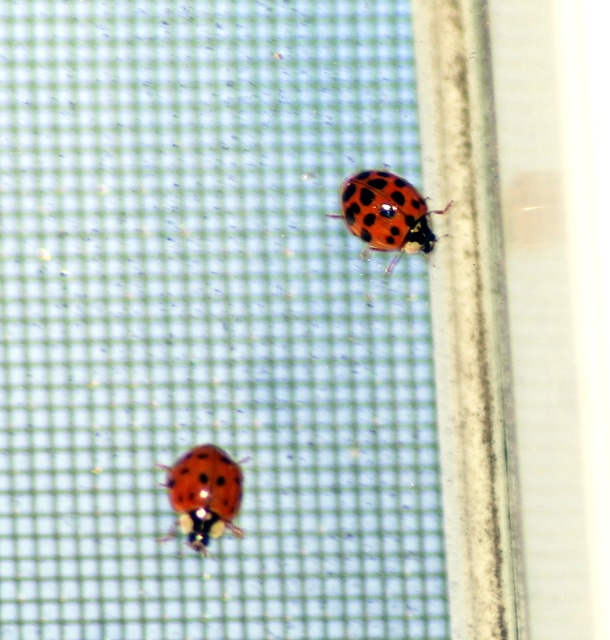
Question: Which object appears closest to the camera in this image?

Choices:
 (A) polka-dotted shell at upper right
 (B) shiny red beetle at lower left

Answer: (B)

Question: Can you confirm if polka-dotted shell at upper right is wider than shiny red beetle at lower left?

Choices:
 (A) no
 (B) yes

Answer: (B)

Question: Which of the following is the closest to the observer?

Choices:
 (A) (415, 202)
 (B) (215, 516)

Answer: (B)

Question: Can you confirm if polka-dotted shell at upper right is positioned to the left of shiny red beetle at lower left?

Choices:
 (A) yes
 (B) no

Answer: (B)

Question: Does polka-dotted shell at upper right have a smaller size compared to shiny red beetle at lower left?

Choices:
 (A) no
 (B) yes

Answer: (A)